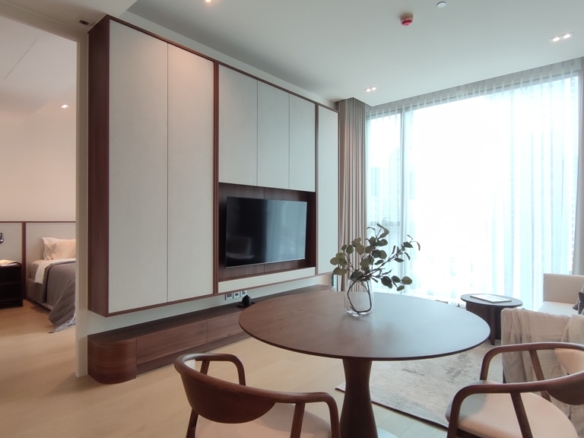
This screenshot has width=584, height=438. I want to click on bed, so click(47, 279).